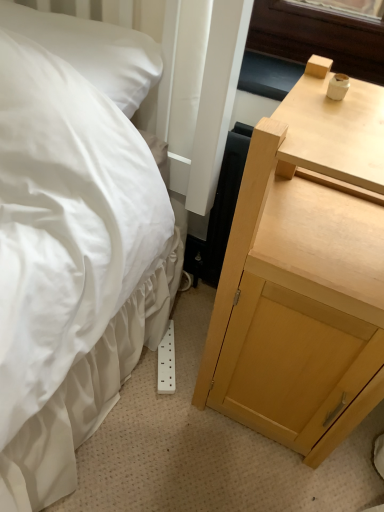
Question: Looking at their shapes, would you say white satin pillow at upper left is wider or thinner than light wood nightstand at right?

Choices:
 (A) wide
 (B) thin

Answer: (B)

Question: Which is correct: white satin pillow at upper left is inside light wood nightstand at right, or outside of it?

Choices:
 (A) outside
 (B) inside

Answer: (A)

Question: Relative to light wood nightstand at right, is white satin pillow at upper left in front or behind?

Choices:
 (A) behind
 (B) front

Answer: (A)

Question: From a real-world perspective, relative to white satin pillow at upper left, is light wood nightstand at right vertically above or below?

Choices:
 (A) below
 (B) above

Answer: (A)

Question: In terms of width, does light wood nightstand at right look wider or thinner when compared to white satin pillow at upper left?

Choices:
 (A) wide
 (B) thin

Answer: (A)

Question: In the image, is light wood nightstand at right on the left side or the right side of white satin pillow at upper left?

Choices:
 (A) left
 (B) right

Answer: (B)

Question: Does point (279, 193) appear closer or farther from the camera than point (77, 59)?

Choices:
 (A) closer
 (B) farther

Answer: (B)